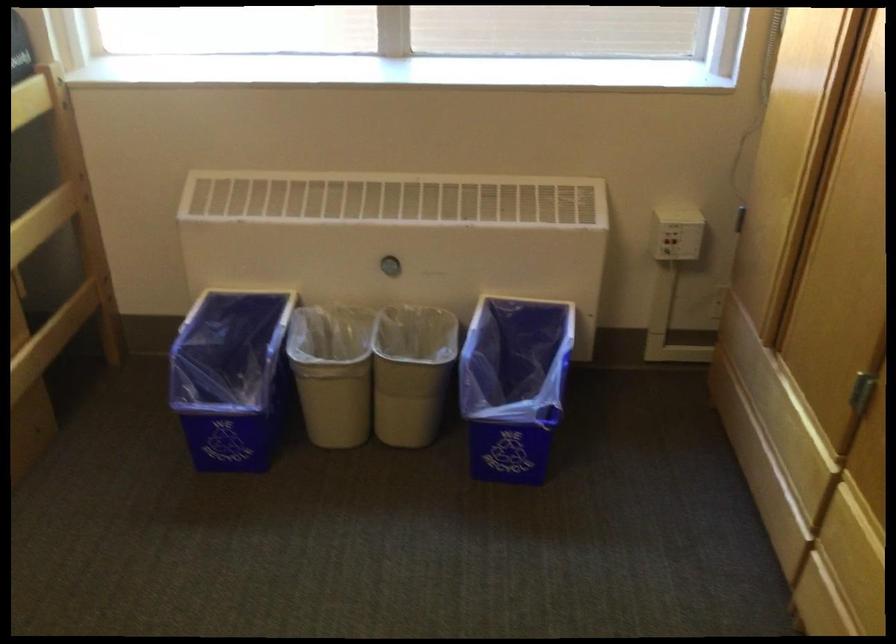
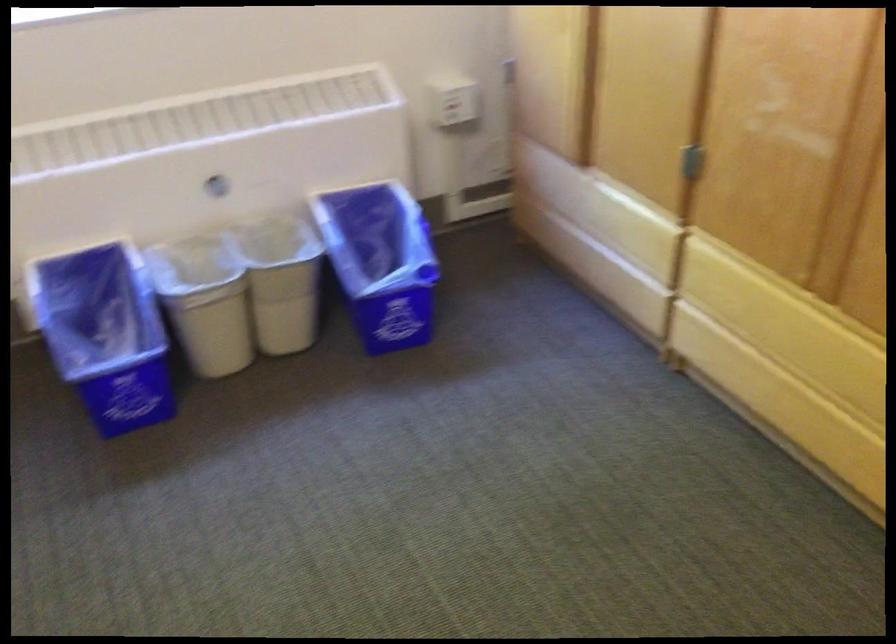
Where in the second image is the point corresponding to point 530,383 from the first image?

(380, 261)